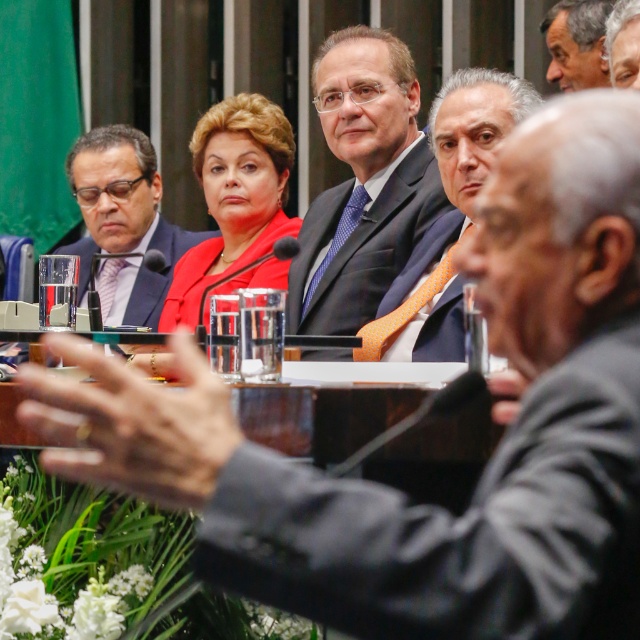
Question: Estimate the real-world distances between objects in this image. Which object is closer to the matte black suit at center?

Choices:
 (A) matte black suit at upper center
 (B) gray hair at upper right
 (C) orange silk tie at center
 (D) matte black suit at upper right

Answer: (C)

Question: Is matte black suit at upper center closer to the viewer compared to matte black suit at upper right?

Choices:
 (A) yes
 (B) no

Answer: (B)

Question: Is orange silk tie at center closer to the viewer compared to matte black suit at upper center?

Choices:
 (A) yes
 (B) no

Answer: (A)

Question: Among these objects, which one is nearest to the camera?

Choices:
 (A) gray hair at upper right
 (B) matte black suit at center

Answer: (A)

Question: Is matte black suit at upper right bigger than gray hair at upper right?

Choices:
 (A) yes
 (B) no

Answer: (A)

Question: Which point is farther from the camera taking this photo?

Choices:
 (A) (88, 227)
 (B) (416, 93)

Answer: (A)